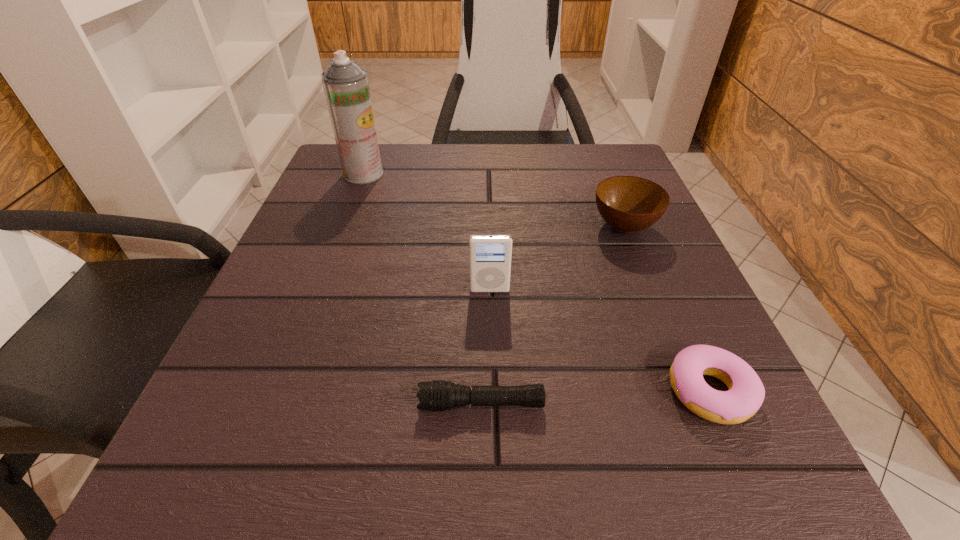
Locate an element on the screen. free space that satisfies the following two spatial constraints: 1. on the front-facing side of the doughnut; 2. on the left side of the iPod is located at coordinates (492, 391).

Locate an element on the screen. This screenshot has height=540, width=960. vacant space that satisfies the following two spatial constraints: 1. on the front-facing side of the third nearest object; 2. at the lens end of the flashlight is located at coordinates (492, 404).